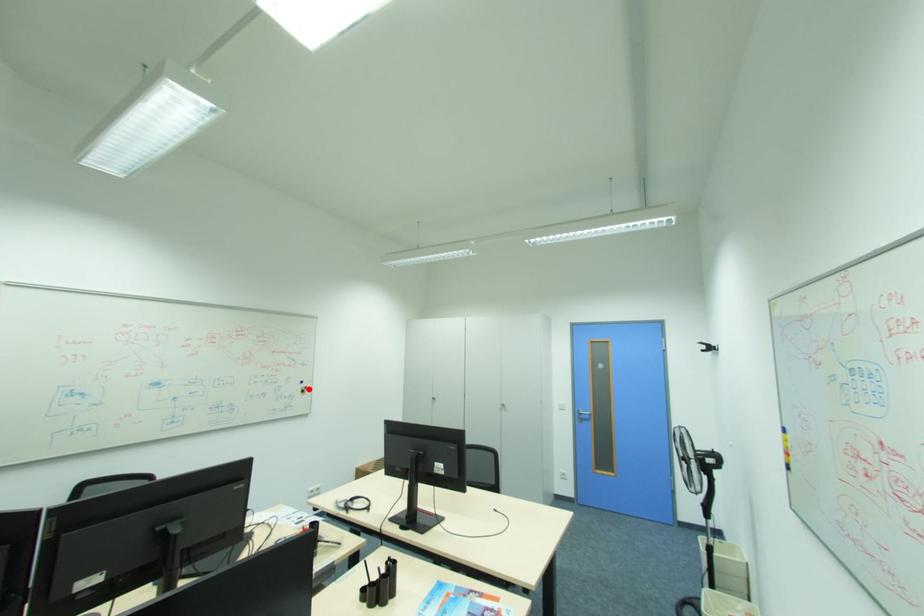
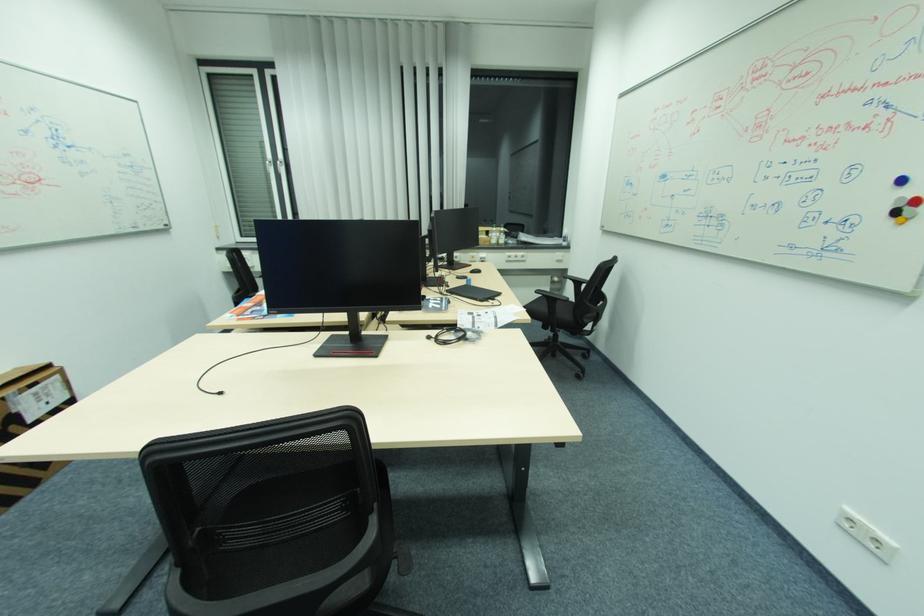
Find the pixel in the second image that matches the highlighted location in the first image.

(907, 206)